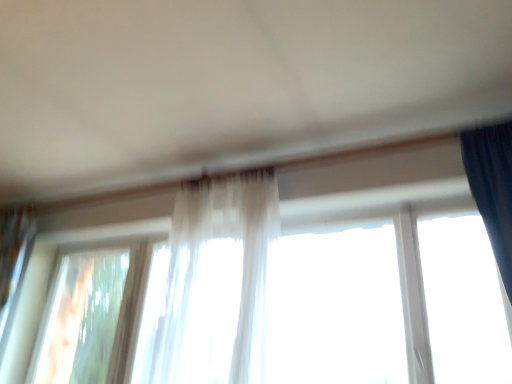
Question: Looking at their shapes, would you say translucent fabric curtain at center is wider or thinner than transparent glass window at lower left, which is the first window in left-to-right order?

Choices:
 (A) wide
 (B) thin

Answer: (A)

Question: Based on their sizes in the image, would you say translucent fabric curtain at center is bigger or smaller than transparent glass window at lower left, placed as the second window when sorted from right to left?

Choices:
 (A) small
 (B) big

Answer: (B)

Question: Which is nearer to the translucent fabric at center, acting as the 1th window starting from the right?

Choices:
 (A) translucent fabric curtain at center
 (B) transparent glass window at lower left, which is the first window in left-to-right order

Answer: (B)

Question: Which object is the farthest from the translucent fabric curtain at center?

Choices:
 (A) transparent glass window at lower left, placed as the second window when sorted from right to left
 (B) translucent fabric at center, which is the second window in left-to-right order

Answer: (A)